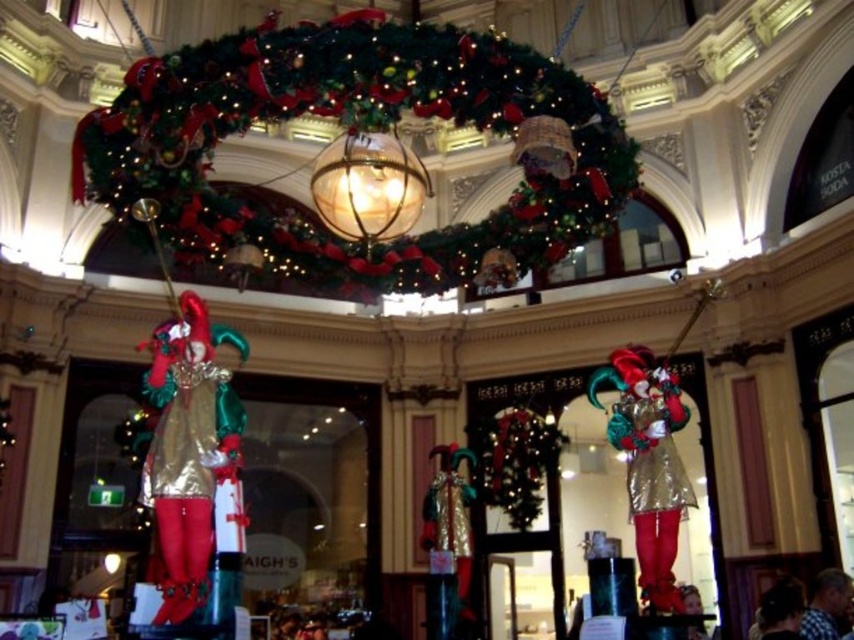
Question: Which point is closer to the camera?

Choices:
 (A) (200, 540)
 (B) (638, 424)

Answer: (A)

Question: Among these objects, which one is nearest to the camera?

Choices:
 (A) green velvet wreath at upper center
 (B) metallic gold jester at center

Answer: (A)

Question: Is green velvet wreath at upper center below metallic gold jester at center?

Choices:
 (A) yes
 (B) no

Answer: (B)

Question: Is green velvet wreath at upper center thinner than metallic gold jester at center?

Choices:
 (A) yes
 (B) no

Answer: (B)

Question: Can you confirm if green velvet wreath at upper center is positioned above metallic gold jester at center?

Choices:
 (A) yes
 (B) no

Answer: (A)

Question: Which point is closer to the camera taking this photo?

Choices:
 (A) (632, 417)
 (B) (208, 525)

Answer: (B)